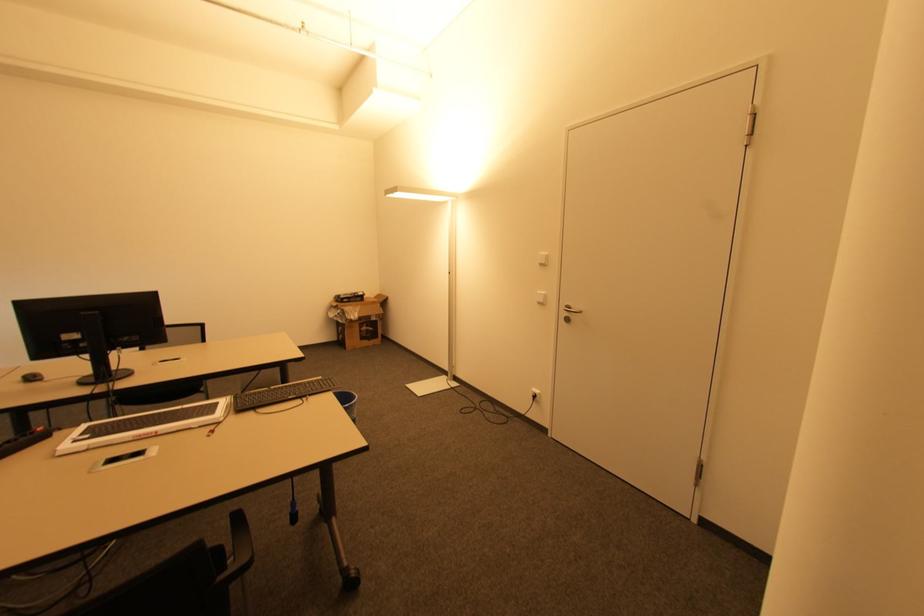
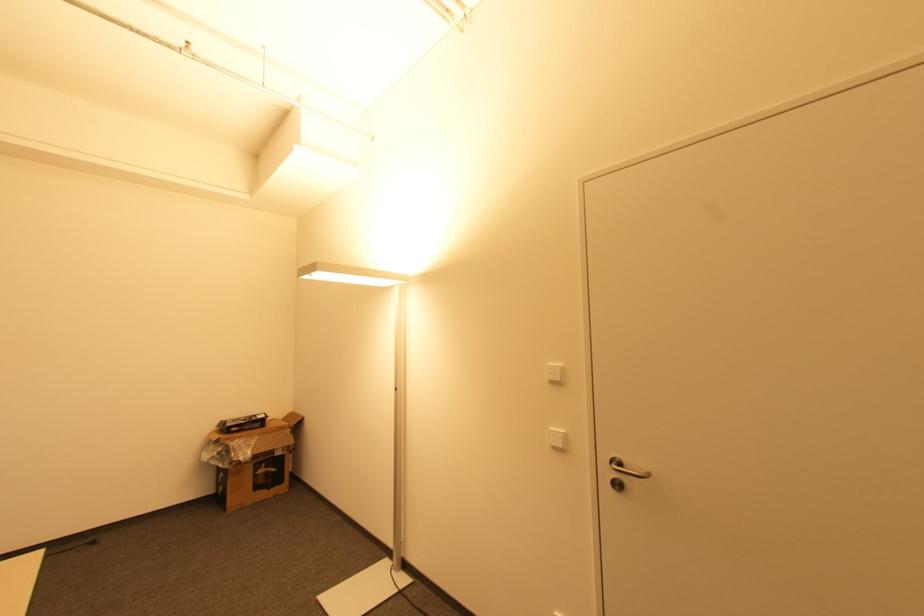
Question: What movement of the cameraman would produce the second image?

Choices:
 (A) Left
 (B) Right
 (C) Forward
 (D) Backward

Answer: (C)